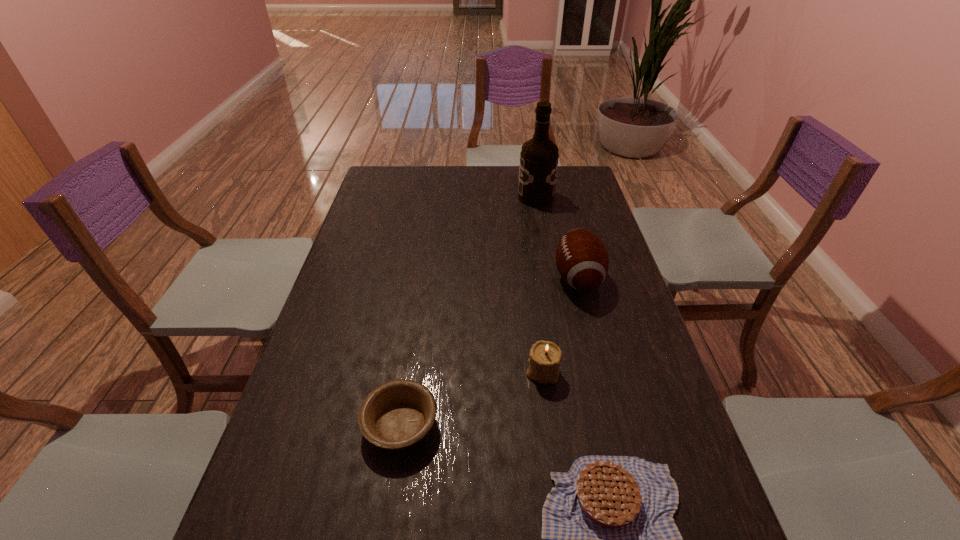
Where is `alcohol`? alcohol is located at coordinates (539, 156).

Image resolution: width=960 pixels, height=540 pixels. What are the coordinates of `the tallest object` in the screenshot? It's located at (539, 156).

You are a GUI agent. You are given a task and a screenshot of the screen. Output one action in this format:
    pyautogui.click(x=<x>, y=<y>)
    Task: Click on the football
    
    Given the screenshot: What is the action you would take?
    pyautogui.click(x=582, y=260)

Where is `the second tallest object`? This screenshot has width=960, height=540. the second tallest object is located at coordinates (582, 260).

The image size is (960, 540). What are the coordinates of `the third farthest object` in the screenshot? It's located at (544, 363).

At what (x,y) coordinates should I click in order to perform the action: click on candle_holder. Please return your answer as a coordinate pair (x, y). Looking at the image, I should click on (544, 363).

Where is `the fourth tallest object`? the fourth tallest object is located at coordinates pyautogui.click(x=396, y=415).

The image size is (960, 540). Identify the location of the leftmost object. (396, 415).

Locate an element on the screen. Image resolution: width=960 pixels, height=540 pixels. free location located 0.220m on the label of the alcohol is located at coordinates point(462,198).

Where is `free space located on the label of the alcohol`? free space located on the label of the alcohol is located at coordinates (500, 198).